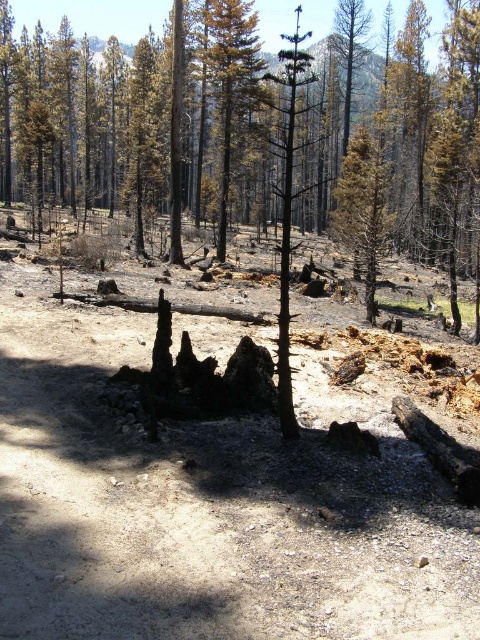
Can you confirm if yellow-green bark tree at center is bigger than charred wood tree at center?

No.

Which is more to the right, yellow-green bark tree at center or charred wood tree at center?

Positioned to the right is charred wood tree at center.

Does point (226, 116) lie behind point (287, 166)?

Yes.

Locate an element on the screen. The height and width of the screenshot is (640, 480). yellow-green bark tree at center is located at coordinates pyautogui.click(x=228, y=81).